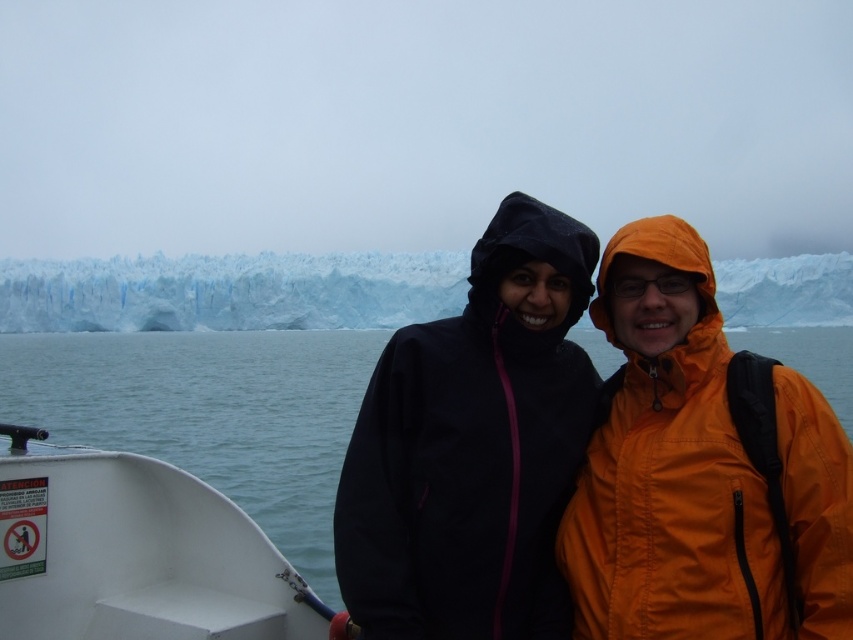
Question: Which object is closer to the camera taking this photo?

Choices:
 (A) matte black jacket at center
 (B) white matte boat at lower left

Answer: (A)

Question: Which of the following is the farthest from the observer?

Choices:
 (A) (312, 593)
 (B) (728, 628)

Answer: (A)

Question: Does matte black jacket at center lie in front of white ice glacier at upper center?

Choices:
 (A) yes
 (B) no

Answer: (A)

Question: Does blue water at lower left have a lesser width compared to white matte boat at lower left?

Choices:
 (A) no
 (B) yes

Answer: (A)

Question: Which object is the closest to the matte black jacket at center?

Choices:
 (A) blue water at lower left
 (B) white matte boat at lower left
 (C) white ice glacier at upper center

Answer: (B)

Question: From the image, what is the correct spatial relationship of blue water at lower left in relation to white matte boat at lower left?

Choices:
 (A) right
 (B) left

Answer: (B)